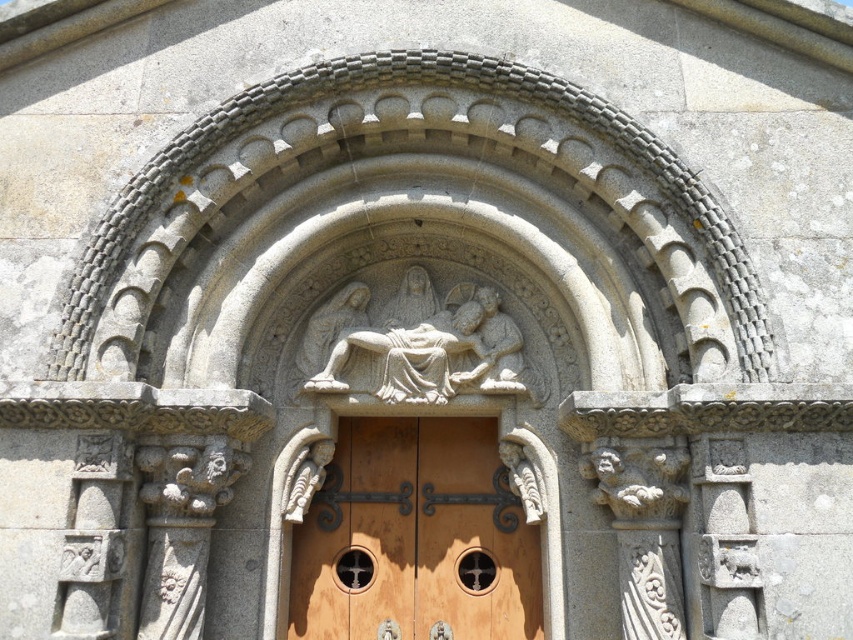
Question: Which object is farther from the camera taking this photo?

Choices:
 (A) gray stone carving at center
 (B) wooden door at center

Answer: (B)

Question: Can you confirm if wooden door at center is bigger than gray stone carving at center?

Choices:
 (A) yes
 (B) no

Answer: (A)

Question: Does wooden door at center have a smaller size compared to gray stone carving at center?

Choices:
 (A) no
 (B) yes

Answer: (A)

Question: Does wooden door at center appear over gray stone carving at center?

Choices:
 (A) yes
 (B) no

Answer: (B)